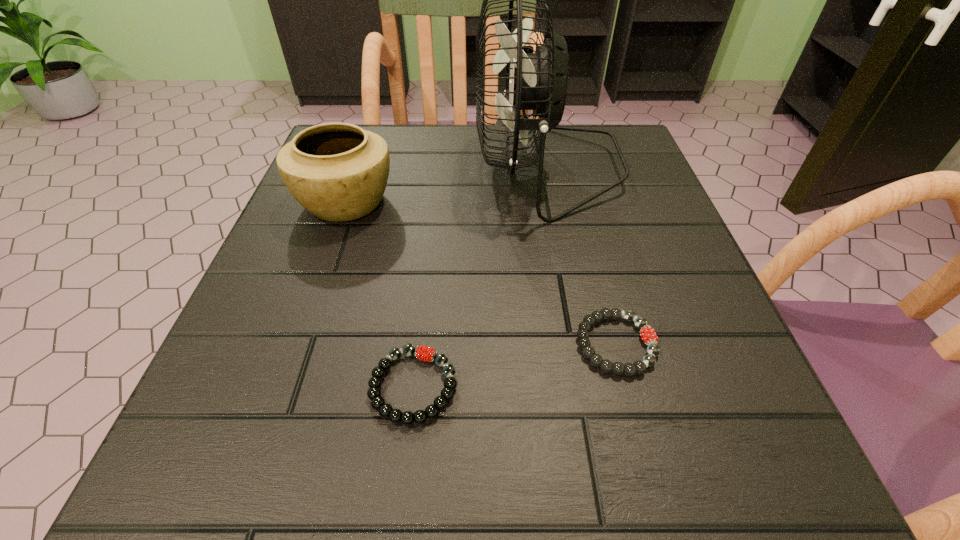
Locate an element on the screen. Image resolution: width=960 pixels, height=540 pixels. vacant point at the left edge is located at coordinates (292, 320).

In the image, there is a desktop. What are the coordinates of `free region at the right edge` in the screenshot? It's located at (660, 399).

Where is `blank space at the far left corner of the desktop`? This screenshot has width=960, height=540. blank space at the far left corner of the desktop is located at coordinates (374, 131).

Where is `vacant space at the near left corner`? This screenshot has height=540, width=960. vacant space at the near left corner is located at coordinates (290, 470).

The height and width of the screenshot is (540, 960). Find the location of `blank area at the far right corner`. blank area at the far right corner is located at coordinates point(632,145).

Find the location of a particular element. free space between the pottery and the right bracelet is located at coordinates (481, 273).

Where is `free point between the fan and the pottery`? This screenshot has height=540, width=960. free point between the fan and the pottery is located at coordinates (446, 185).

You are a GUI agent. You are given a task and a screenshot of the screen. Output one action in this format:
    pyautogui.click(x=<x>, y=<y>)
    Task: Click on the free spot between the pottery and the right bracelet
    The image size is (960, 540).
    Given the screenshot: What is the action you would take?
    pyautogui.click(x=481, y=273)

Where is `blank region between the fan and the left bracelet`? blank region between the fan and the left bracelet is located at coordinates (481, 277).

The width and height of the screenshot is (960, 540). Identify the location of empty space between the leftmost object and the tallest object. (446, 185).